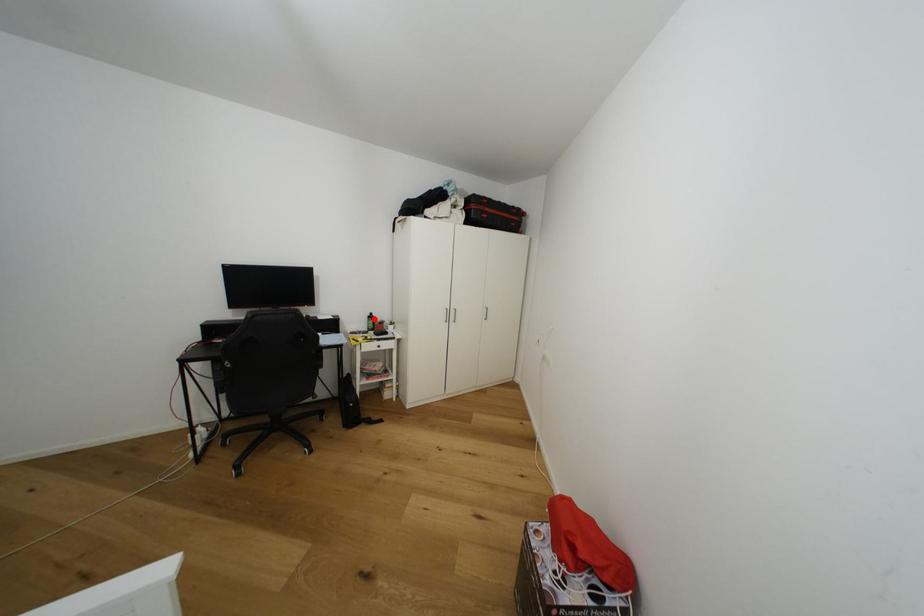
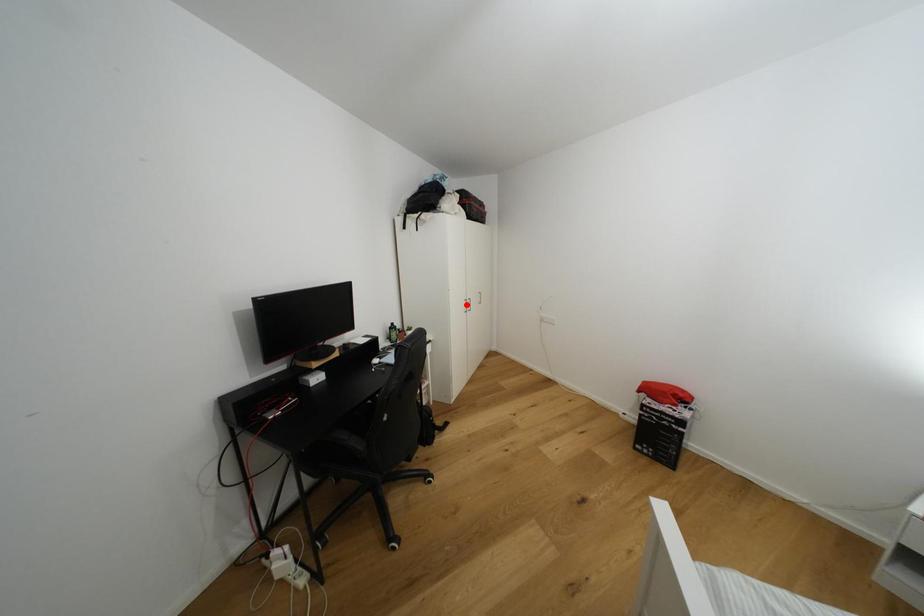
I am providing you with two images of the same scene from different viewpoints. A red point is marked on the first image and another point is marked on the second image. Does the point marked in image1 correspond to the same location as the one in image2?

No